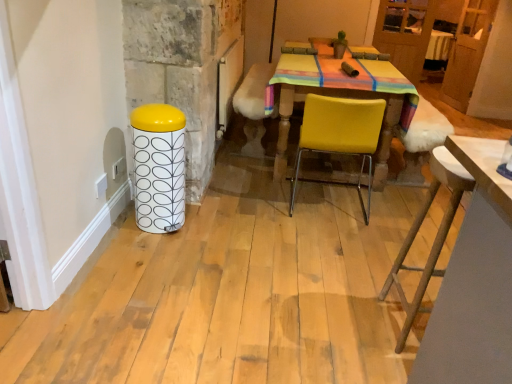
The width and height of the screenshot is (512, 384). In order to click on free space in front of yellow matte chair at center in this screenshot , I will do `click(327, 241)`.